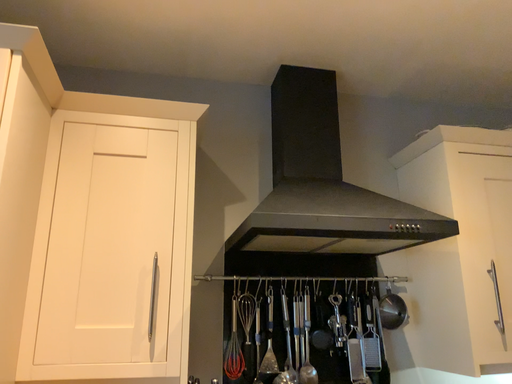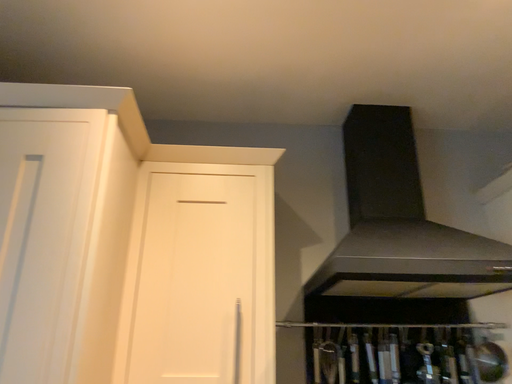
Question: Which way did the camera rotate in the video?

Choices:
 (A) rotated left
 (B) rotated right

Answer: (A)